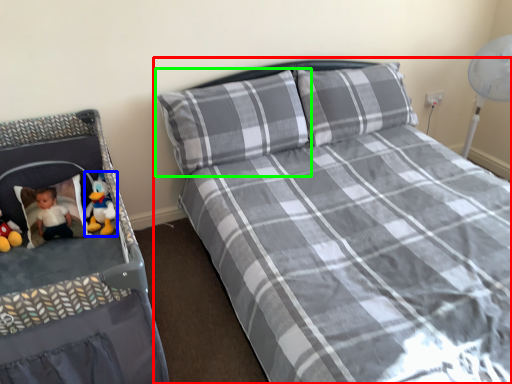
Question: Which is farther away from bed (highlighted by a red box)? toy (highlighted by a blue box) or pillow (highlighted by a green box)?

Choices:
 (A) toy
 (B) pillow

Answer: (A)